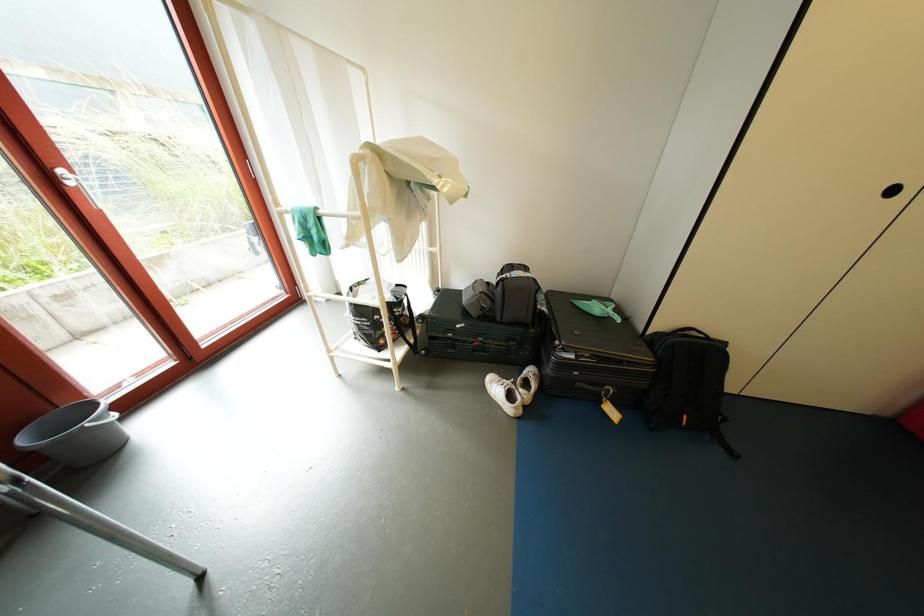
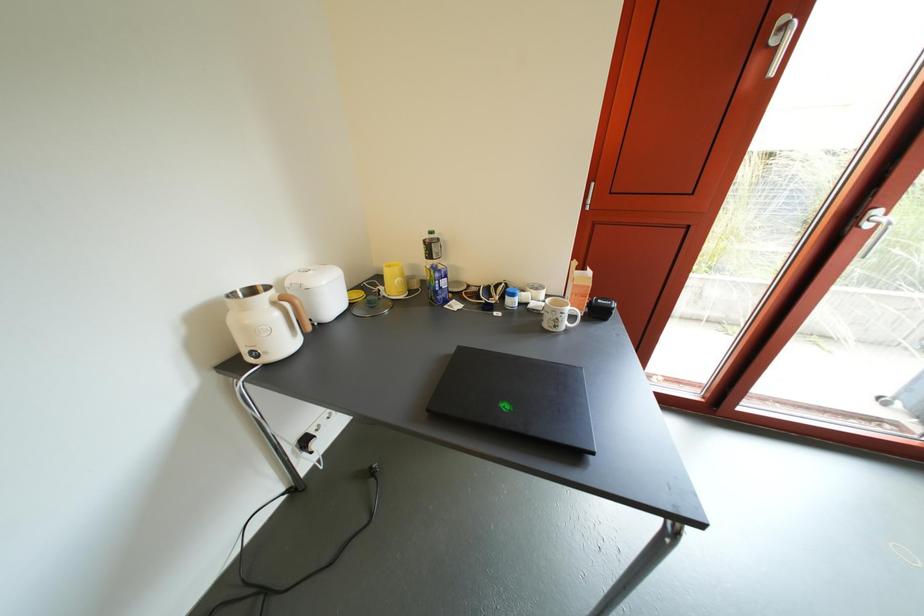
The first image is from the beginning of the video and the second image is from the end. How did the camera likely rotate when shooting the video?

The camera's rotation is toward left-down.